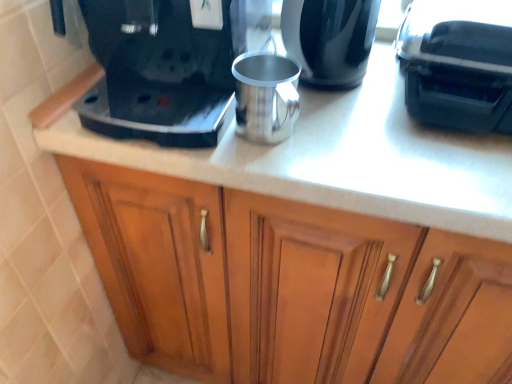
The height and width of the screenshot is (384, 512). Find the location of `vacant space in front of black plastic coffee machine at upper right`. vacant space in front of black plastic coffee machine at upper right is located at coordinates (437, 170).